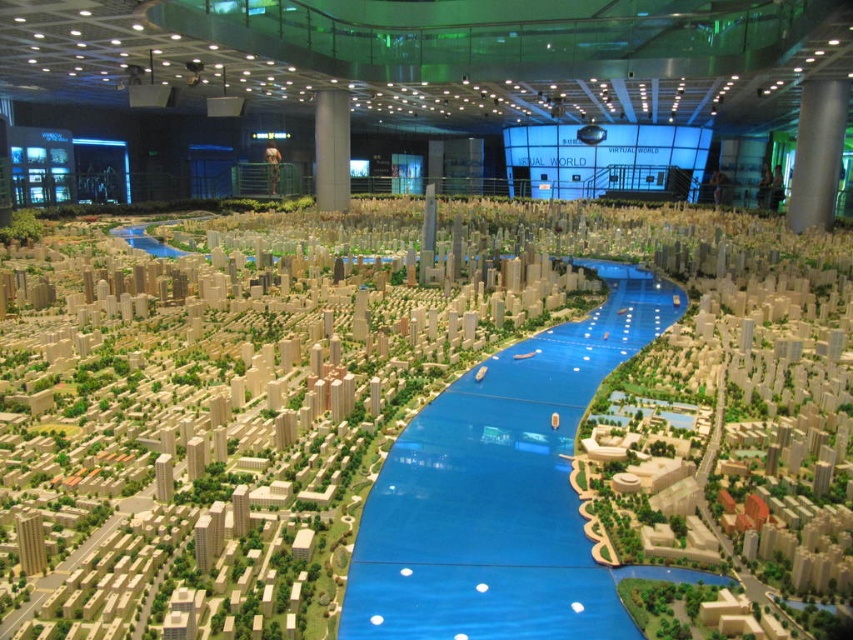
Question: Is transparent blue waterway at center positioned behind metallic gray pillar at upper right?

Choices:
 (A) no
 (B) yes

Answer: (A)

Question: Is transparent blue waterway at center further to the viewer compared to metallic gray pillar at upper right?

Choices:
 (A) yes
 (B) no

Answer: (B)

Question: Which is farther from the metallic gray pillar at upper right?

Choices:
 (A) transparent blue waterway at center
 (B) white glossy pillar at center

Answer: (A)

Question: Which object is the closest to the white glossy pillar at center?

Choices:
 (A) transparent blue waterway at center
 (B) metallic gray pillar at upper right

Answer: (B)

Question: Among these objects, which one is farthest from the camera?

Choices:
 (A) white glossy pillar at center
 (B) transparent blue waterway at center

Answer: (A)

Question: Does transparent blue waterway at center have a lesser width compared to white glossy pillar at center?

Choices:
 (A) no
 (B) yes

Answer: (A)